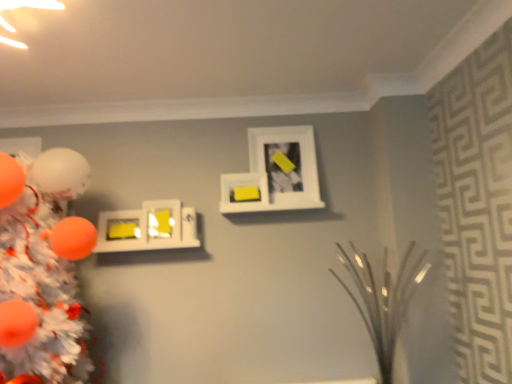
Question: Would you say matte yellow picture frame at center-left, the 3th picture frame in the right-to-left sequence, is to the left or to the right of yellow matte picture frame at upper center, arranged as the second picture frame when viewed from the right, in the picture?

Choices:
 (A) left
 (B) right

Answer: (A)

Question: Considering their positions, is matte yellow picture frame at center-left, the 3th picture frame in the right-to-left sequence, located in front of or behind yellow matte picture frame at upper center, arranged as the second picture frame when viewed from the right?

Choices:
 (A) front
 (B) behind

Answer: (B)

Question: Estimate the real-world distances between objects in this image. Which object is closer to the white matte picture frame at upper center, which is counted as the 1th picture frame, starting from the right?

Choices:
 (A) yellow matte picture frame at center left, placed as the first picture frame when sorted from left to right
 (B) orange matte christmas tree at left
 (C) clear glass vase at center right
 (D) yellow matte picture frame at upper center, arranged as the second picture frame when viewed from the right
 (E) matte yellow picture frame at center-left, arranged as the 2th picture frame when viewed from the left

Answer: (D)

Question: Based on their relative distances, which object is nearer to the clear glass vase at center right?

Choices:
 (A) white matte picture frame at upper center, which appears as the 4th picture frame when viewed from the left
 (B) matte yellow picture frame at center-left, the 3th picture frame in the right-to-left sequence
 (C) yellow matte picture frame at upper center, arranged as the second picture frame when viewed from the right
 (D) orange matte christmas tree at left
 (E) yellow matte picture frame at center left, placed as the first picture frame when sorted from left to right

Answer: (A)